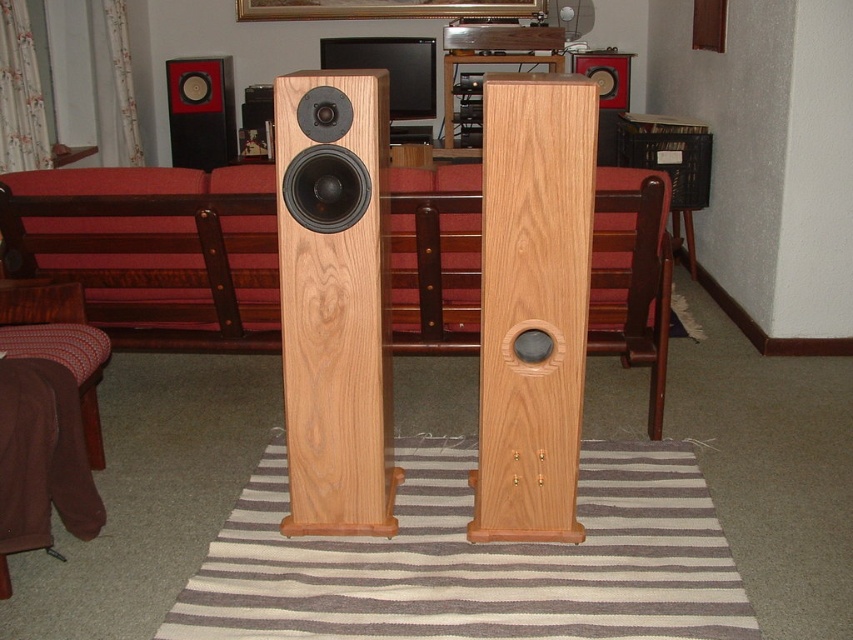
Can you confirm if matte black speaker at upper left is thinner than matte black speaker at upper center?

Incorrect, matte black speaker at upper left's width is not less than matte black speaker at upper center's.

This screenshot has width=853, height=640. Describe the element at coordinates (200, 113) in the screenshot. I see `matte black speaker at upper left` at that location.

You are a GUI agent. You are given a task and a screenshot of the screen. Output one action in this format:
    pyautogui.click(x=<x>, y=<y>)
    Task: Click on the matte black speaker at upper left
    
    Given the screenshot: What is the action you would take?
    pyautogui.click(x=200, y=113)

Measure the distance between point (372, 465) and camera.

Point (372, 465) is 6.63 feet from camera.

Between point (312, 348) and point (590, 65), which one is positioned behind?

Point (590, 65)

At what (x,y) coordinates should I click in order to perform the action: click on natural wood speaker at center. Please return your answer as a coordinate pair (x, y). The image size is (853, 640). Looking at the image, I should click on (335, 300).

Identify the location of natural wood speaker at center. (335, 300).

Which is more to the left, natural wood speaker at center or matte black speaker at upper left?

Positioned to the left is matte black speaker at upper left.

Between natural wood speaker at center and matte black speaker at upper left, which one is positioned lower?

natural wood speaker at center is below.

What do you see at coordinates (335, 300) in the screenshot? I see `natural wood speaker at center` at bounding box center [335, 300].

I want to click on natural wood speaker at center, so click(x=335, y=300).